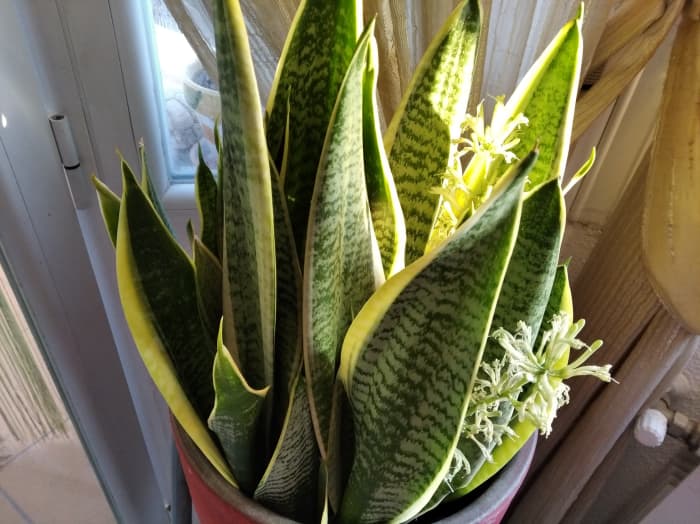
This screenshot has height=524, width=700. Find the location of `leftmost plant leaf`. leftmost plant leaf is located at coordinates (110, 203).